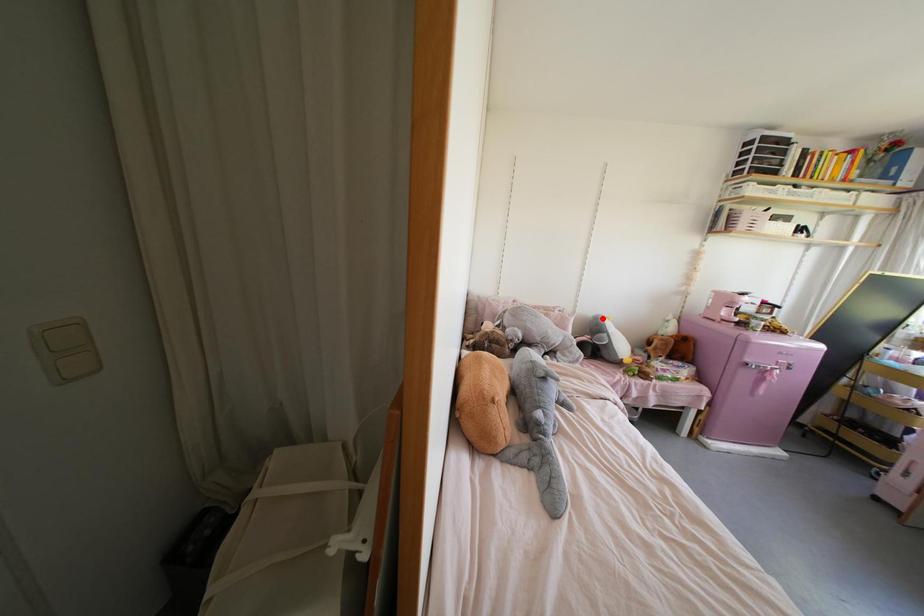
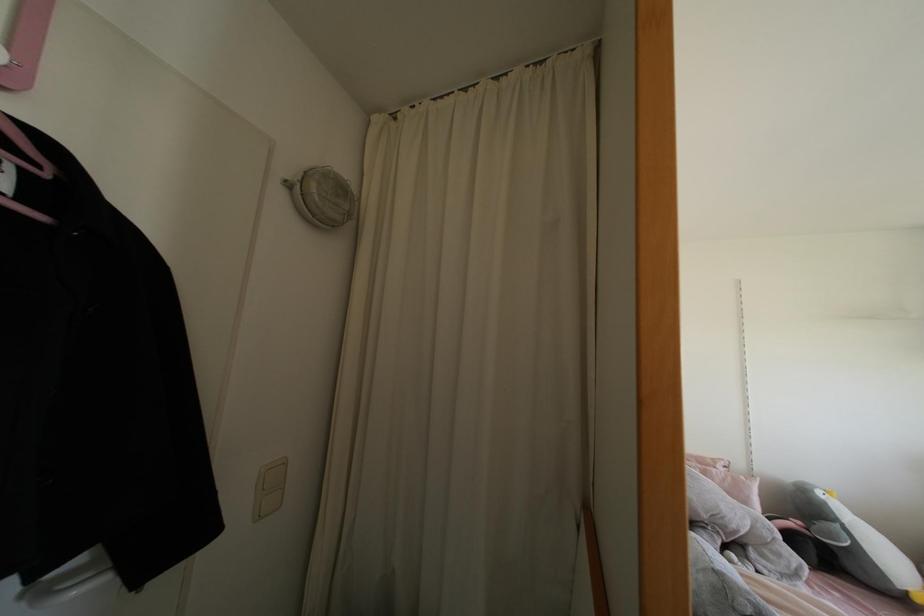
Locate, in the second image, the point that corresponds to the highlighted location in the first image.

(819, 493)